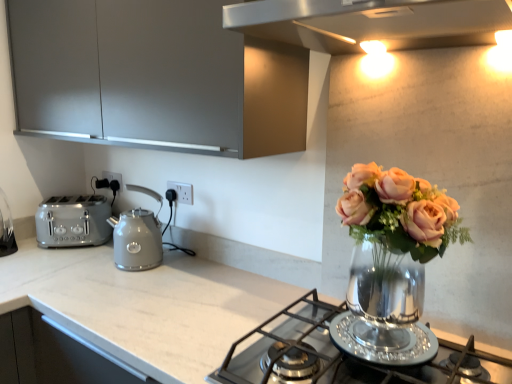
Question: Looking at their shapes, would you say satin silver toaster at left is wider or thinner than white glossy countertop at center?

Choices:
 (A) wide
 (B) thin

Answer: (B)

Question: Considering the relative positions of satin silver toaster at left and white glossy countertop at center in the image provided, is satin silver toaster at left to the left or to the right of white glossy countertop at center?

Choices:
 (A) left
 (B) right

Answer: (A)

Question: Based on their relative distances, which object is farther from the clear glass vase at center?

Choices:
 (A) white plastic electric outlet at center, the second electric outlet from the left
 (B) polished stainless steel gas stove at center
 (C) white plastic electric outlet at center, the first electric outlet positioned from the back
 (D) matte gray cabinet at upper left
 (E) white glossy countertop at center

Answer: (C)

Question: Estimate the real-world distances between objects in this image. Which object is closer to the matte gray kettle at center?

Choices:
 (A) polished stainless steel gas stove at center
 (B) satin silver toaster at left
 (C) clear glass vase at center
 (D) white plastic electric outlet at center, which appears as the 1th electric outlet when viewed from the left
 (E) white plastic electric outlet at center, which is counted as the first electric outlet, starting from the front

Answer: (B)